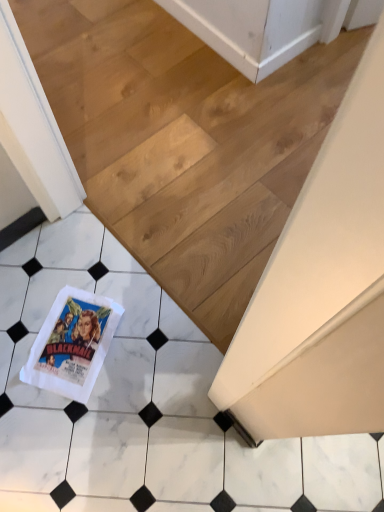
Find the location of a particular element. Image resolution: width=384 pixels, height=512 pixels. free point behind white paper towel at lower left is located at coordinates (84, 266).